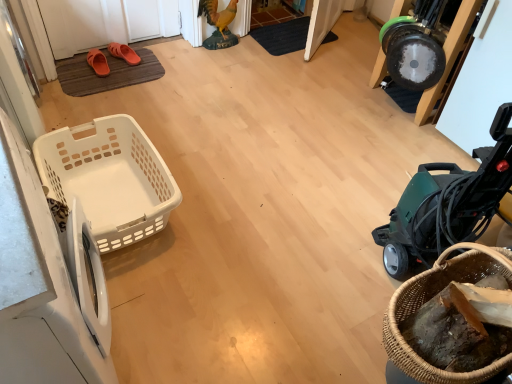
Where is `vacant area in front of black textured doormat at center, which is the first doormat in top-to-bottom order`? The image size is (512, 384). vacant area in front of black textured doormat at center, which is the first doormat in top-to-bottom order is located at coordinates (293, 71).